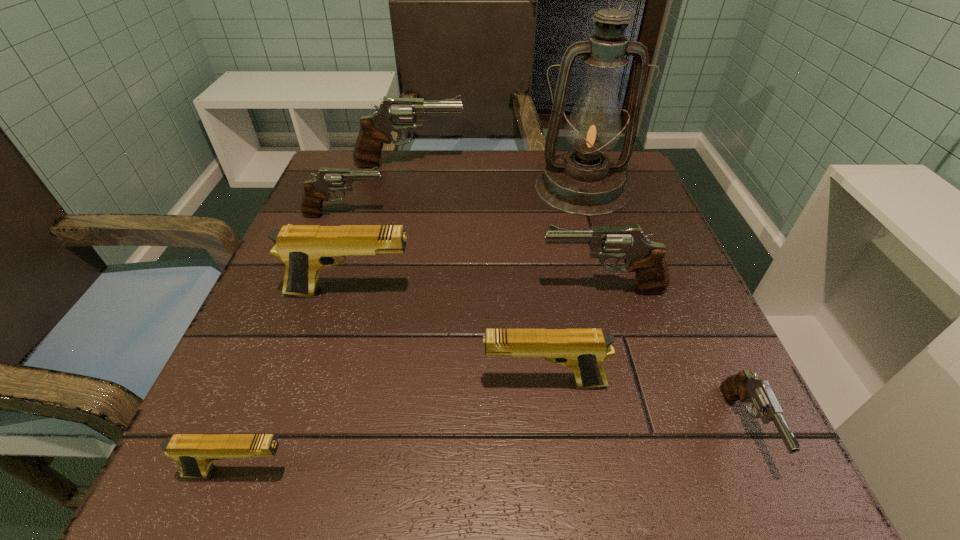
Locate an element on the screen. The width and height of the screenshot is (960, 540). object present at the near right corner is located at coordinates coord(743,386).

Identify the location of free space at the far edge of the desktop. The height and width of the screenshot is (540, 960). (504, 171).

You are a GUI agent. You are given a task and a screenshot of the screen. Output one action in this format:
    pyautogui.click(x=<x>, y=<y>)
    Task: Click on the free space at the near edge
    The width and height of the screenshot is (960, 540).
    Given the screenshot: What is the action you would take?
    pyautogui.click(x=327, y=459)

Where is `free space at the left edge of the desktop`? The image size is (960, 540). free space at the left edge of the desktop is located at coordinates (268, 292).

The height and width of the screenshot is (540, 960). In the image, there is a desktop. What are the coordinates of `vacant space at the right edge` in the screenshot? It's located at (694, 401).

Locate an element on the screen. This screenshot has height=540, width=960. blank space at the far left corner is located at coordinates (332, 194).

Find the location of a particular element. This screenshot has height=540, width=960. free space between the third gray pistol from left to right and the farthest gray pistol is located at coordinates (506, 227).

Image resolution: width=960 pixels, height=540 pixels. Identify the location of vacant area that lies between the smallest tan pistol and the tallest object. (411, 330).

This screenshot has height=540, width=960. What are the coordinates of `free space between the biggest gray pistol and the second smallest tan pistol` in the screenshot? It's located at (477, 274).

Find the location of a particular element. The image size is (960, 540). empty location between the second smallest gray pistol and the smallest tan pistol is located at coordinates coord(293,343).